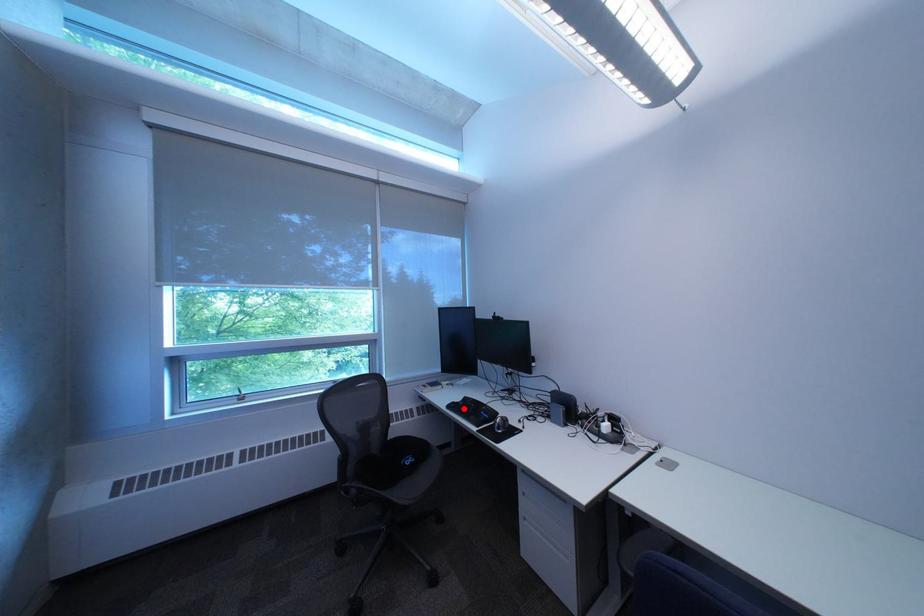
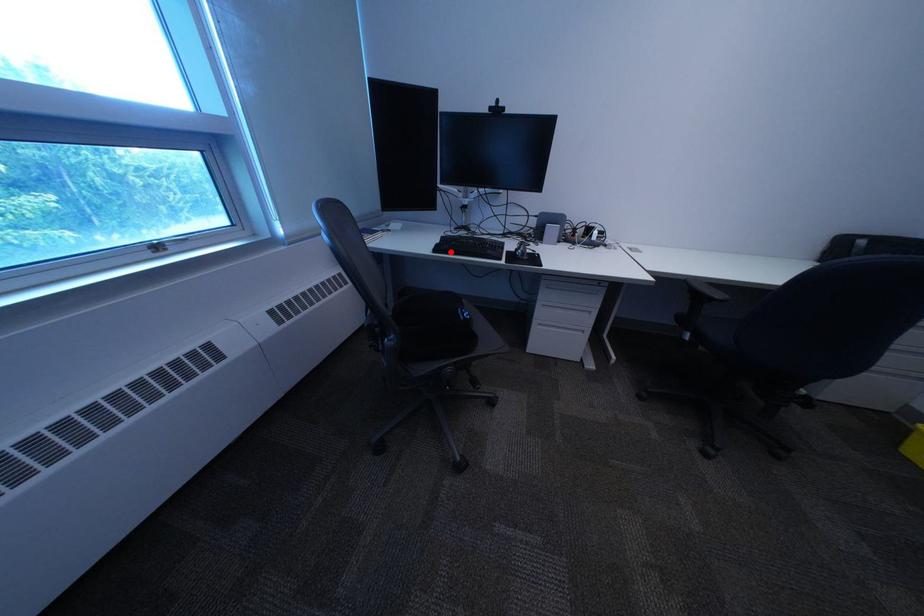
I am providing you with two images of the same scene from different viewpoints. A red point is marked on the first image and another point is marked on the second image. Does the point marked in image1 correspond to the same location as the one in image2?

Yes